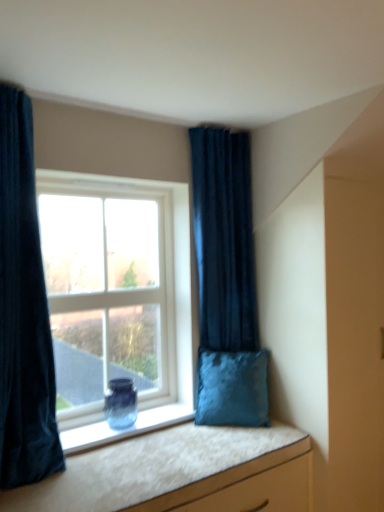
Find the location of a particular element. vacant space situated above white textured vanity at lower right (from a real-world perspective) is located at coordinates (142, 459).